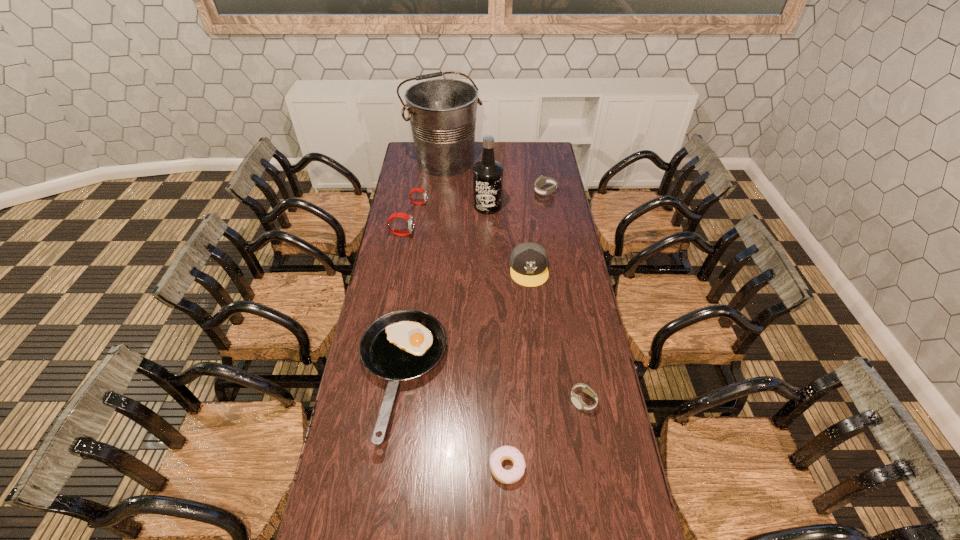
You are a GUI agent. You are given a task and a screenshot of the screen. Output one action in this format:
    pyautogui.click(x=<x>, y=<y>)
    Task: Click on the frying pan
    
    Given the screenshot: What is the action you would take?
    pyautogui.click(x=396, y=539)

Where is `the nearer white watch`? the nearer white watch is located at coordinates (414, 539).

Locate an element on the screen. the nearest watch is located at coordinates (414, 539).

Where is `doughnut`? The image size is (960, 540). doughnut is located at coordinates (499, 539).

You are a GUI agent. You are given a task and a screenshot of the screen. Output one action in this format:
    pyautogui.click(x=<x>, y=<y>)
    Task: Click on the shortest object
    
    Given the screenshot: What is the action you would take?
    pyautogui.click(x=499, y=539)

This screenshot has height=540, width=960. Identify the location of free space located 0.130m on the front of the farthest object. (441, 193).

At what (x,y) coordinates should I click in order to perform the action: click on vacant region located on the front label of the liquor. Please return your answer as a coordinate pair (x, y). This screenshot has width=960, height=540. Looking at the image, I should click on (488, 228).

Image resolution: width=960 pixels, height=540 pixels. I want to click on vacant space located on the face of the seventh shortest object, so click(x=452, y=234).

The image size is (960, 540). What are the coordinates of `blank space located 0.230m on the front-facing side of the gray cap` in the screenshot? It's located at (536, 331).

Where is `blank space located on the face of the farther red watch`? blank space located on the face of the farther red watch is located at coordinates (439, 203).